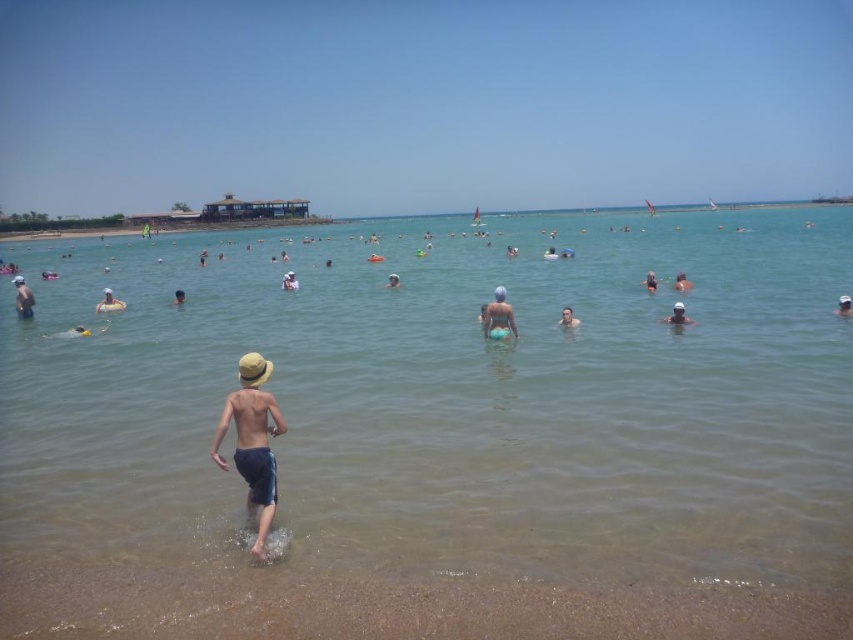
Who is taller, clear water at center or light blue fabric swimmer at center?

Standing taller between the two is clear water at center.

Can you confirm if clear water at center is positioned to the right of light blue fabric swimmer at center?

Yes, clear water at center is to the right of light blue fabric swimmer at center.

Where is `clear water at center`? clear water at center is located at coordinates coord(451,396).

The image size is (853, 640). In order to click on clear water at center in this screenshot , I will do `click(451, 396)`.

Does point (267, 525) come in front of point (109, 305)?

Yes, it is in front of point (109, 305).

Who is lower down, light yellow straw hat at center or light blue fabric swimmer at center?

light yellow straw hat at center is below.

Who is more distant from viewer, (233, 404) or (119, 305)?

Positioned behind is point (119, 305).

Where is `light yellow straw hat at center`? light yellow straw hat at center is located at coordinates (252, 440).

Image resolution: width=853 pixels, height=640 pixels. What are the coordinates of `clear water at center` in the screenshot? It's located at (451, 396).

How much distance is there between clear water at center and light yellow straw hat at center?

clear water at center and light yellow straw hat at center are 36.05 meters apart.

Is point (196, 339) more distant than point (274, 496)?

Yes, it is.

The width and height of the screenshot is (853, 640). Identify the location of clear water at center. (451, 396).